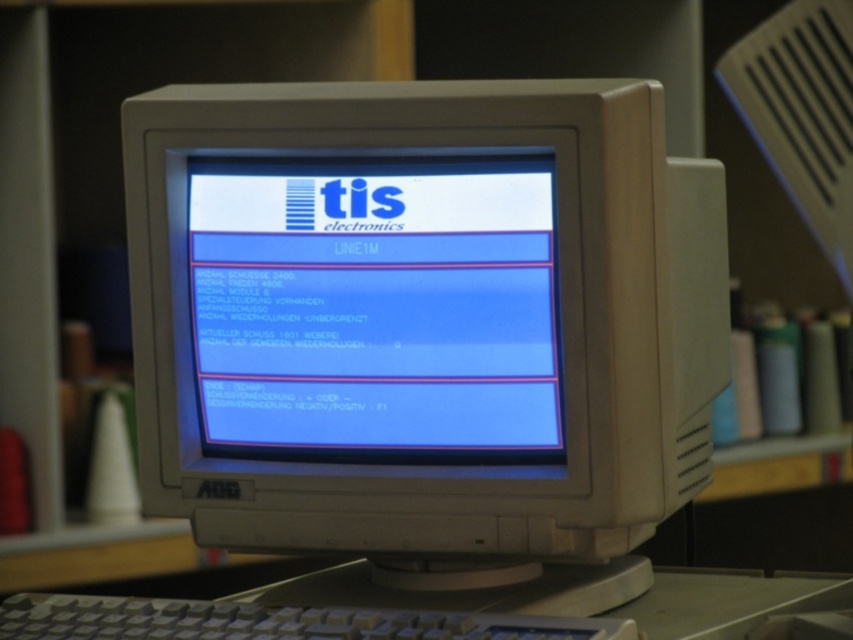
Is point (462, 260) in front of point (167, 44)?

That is True.

Does point (517, 442) come farther from viewer compared to point (190, 38)?

That is False.

In order to click on blue glossy monitor at center in this screenshot , I will do `click(376, 307)`.

Looking at this image, can you confirm if white plastic computer desk at center is positioned to the left of blue glossy monitor at center?

In fact, white plastic computer desk at center is to the right of blue glossy monitor at center.

Based on the photo, between white plastic computer desk at center and blue glossy monitor at center, which one appears on the right side from the viewer's perspective?

From the viewer's perspective, white plastic computer desk at center appears more on the right side.

Where is `white plastic computer desk at center`? white plastic computer desk at center is located at coordinates (426, 326).

Consider the image. Can you confirm if white plastic computer desk at center is positioned to the left of matte white bookshelf at center?

Incorrect, white plastic computer desk at center is not on the left side of matte white bookshelf at center.

Does white plastic computer desk at center appear on the right side of matte white bookshelf at center?

Indeed, white plastic computer desk at center is positioned on the right side of matte white bookshelf at center.

Is point (328, 115) positioned before point (360, 44)?

Yes, it is in front of point (360, 44).

The height and width of the screenshot is (640, 853). In order to click on white plastic computer desk at center in this screenshot , I will do `click(426, 326)`.